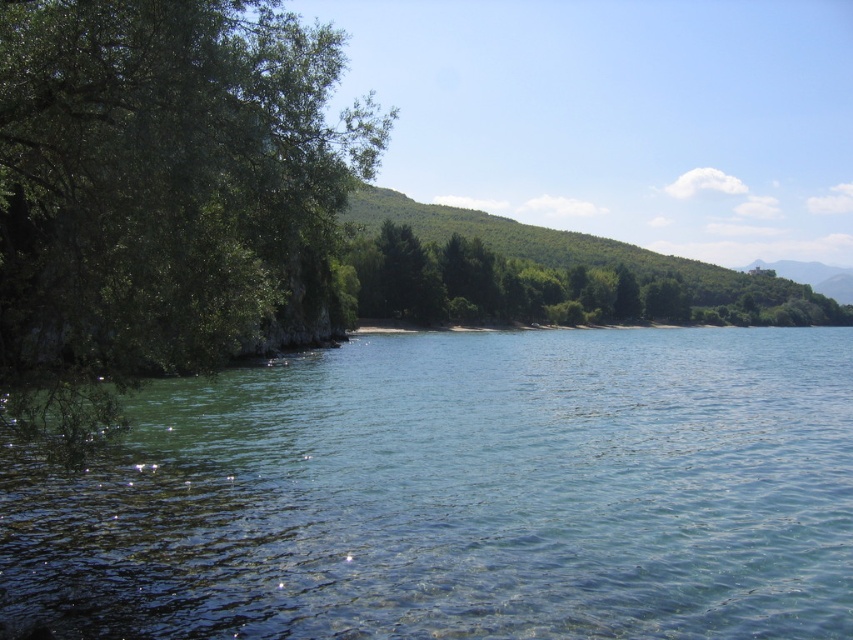
You are standing at the lakeside and want to take a photo of the green leafy tree at left and the clear water at center. Which object should you focus on first if you want to capture both in a single frame without moving your camera?

You should focus on the green leafy tree at left first because the clear water at center is located below it, so adjusting the camera angle to include both would require framing from the top down.

You are standing at the center of the image and want to locate the green leafy tree at left. Which direction should you look to find it?

The green leafy tree at left is located at point 0.294 on the x axis and 0.185 on the y axis. Since the x coordinate is 0.294, which is less than 0.5, it is to the left of the center. The y coordinate 0.185 is below 0.5, so it is also lower than the center. Therefore, you should look to the lower left direction to find the green leafy tree at left.